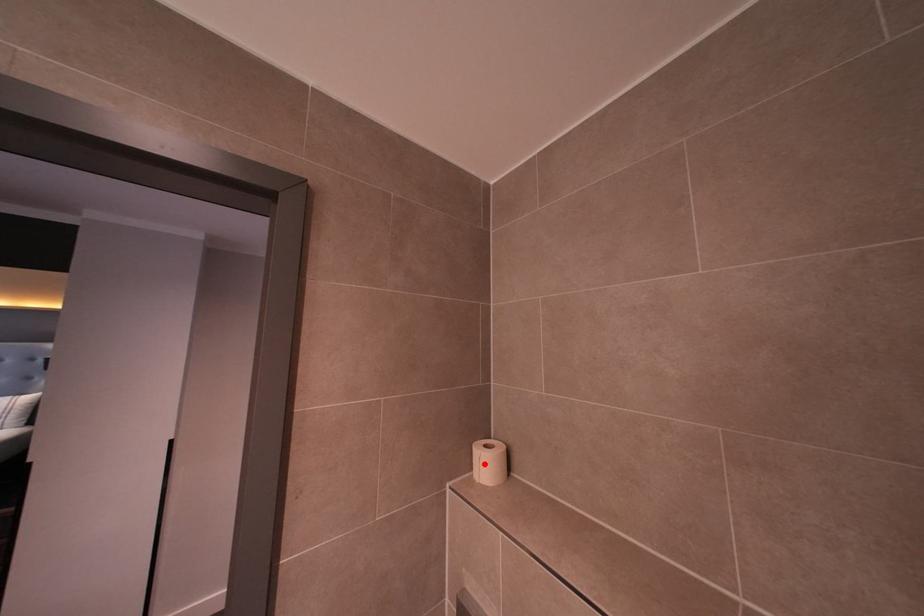
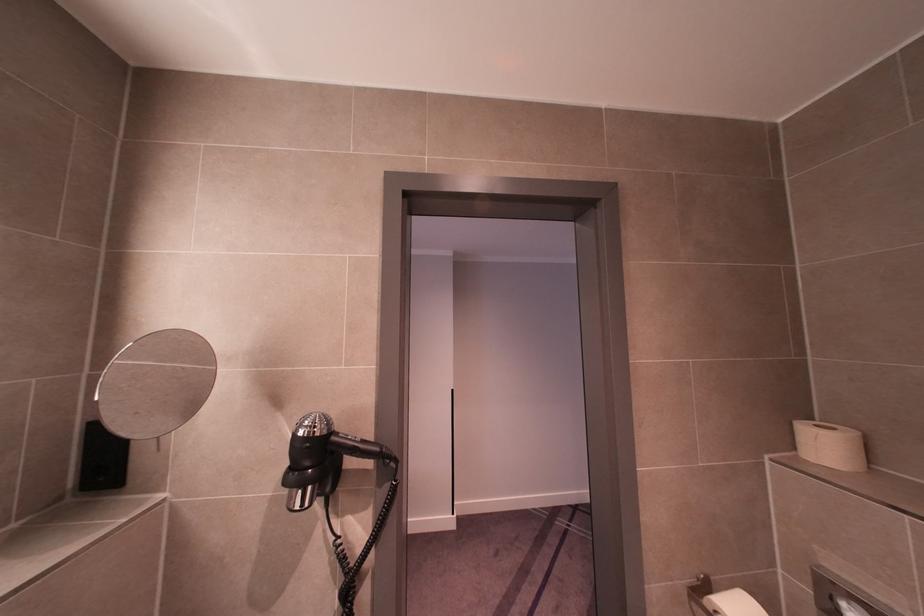
Where in the second image is the point corresponding to the highlighted location from the first image?

(823, 446)